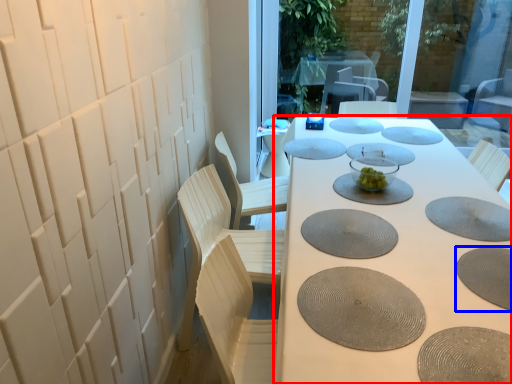
Question: Which object appears farthest to the camera in this image, table (highlighted by a red box) or manhole cover (highlighted by a blue box)?

Choices:
 (A) table
 (B) manhole cover

Answer: (B)